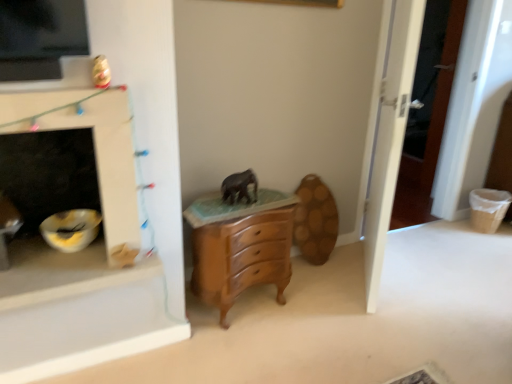
The width and height of the screenshot is (512, 384). Identify the location of blank area to the left of white wooden door at right. (323, 277).